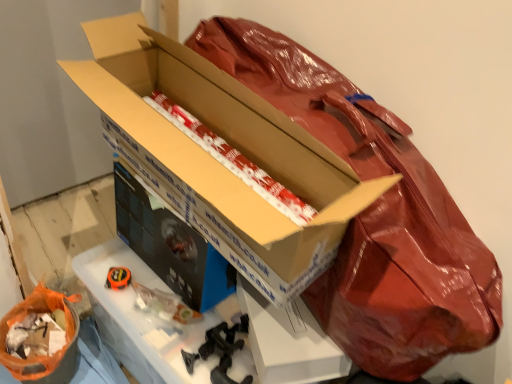
Question: Does black cardboard workbench at center appear on the left side of white/red striped paper at center, the 2th wrapping paper when ordered from left to right?

Choices:
 (A) yes
 (B) no

Answer: (A)

Question: Is black cardboard workbench at center wider than white/red striped paper at center, the 1th wrapping paper positioned from the right?

Choices:
 (A) yes
 (B) no

Answer: (A)

Question: Could you tell me if black cardboard workbench at center is turned towards white/red striped paper at center, the 1th wrapping paper in the top-to-bottom sequence?

Choices:
 (A) yes
 (B) no

Answer: (B)

Question: Is black cardboard workbench at center at the right side of white/red striped paper at center, the 2th wrapping paper when ordered from left to right?

Choices:
 (A) no
 (B) yes

Answer: (A)

Question: Is black cardboard workbench at center far away from white/red striped paper at center, the second wrapping paper ordered from the bottom?

Choices:
 (A) no
 (B) yes

Answer: (A)

Question: Considering the positions of matte cardboard box at center, arranged as the 2th box when viewed from the front, and black cardboard workbench at center in the image, is matte cardboard box at center, arranged as the 2th box when viewed from the front, taller or shorter than black cardboard workbench at center?

Choices:
 (A) tall
 (B) short

Answer: (B)

Question: Is matte cardboard box at center, arranged as the 2th box when viewed from the front, in front of or behind black cardboard workbench at center in the image?

Choices:
 (A) behind
 (B) front

Answer: (A)

Question: Is point (215, 251) positioned closer to the camera than point (293, 339)?

Choices:
 (A) farther
 (B) closer

Answer: (A)

Question: Looking at their shapes, would you say matte cardboard box at center, arranged as the 2th box when viewed from the front, is wider or thinner than black cardboard workbench at center?

Choices:
 (A) wide
 (B) thin

Answer: (B)

Question: From the image's perspective, relative to orange plastic bag at lower left, the first wrapping paper positioned from the left, is cardboard box at center, which is counted as the 2th box, starting from the back, above or below?

Choices:
 (A) below
 (B) above

Answer: (B)

Question: Is point 161,64 positioned closer to the camera than point 58,350?

Choices:
 (A) closer
 (B) farther

Answer: (A)

Question: Considering the positions of cardboard box at center, the 1th box when ordered from front to back, and orange plastic bag at lower left, the 2th wrapping paper in the right-to-left sequence, in the image, is cardboard box at center, the 1th box when ordered from front to back, taller or shorter than orange plastic bag at lower left, the 2th wrapping paper in the right-to-left sequence,?

Choices:
 (A) short
 (B) tall

Answer: (B)

Question: Considering the positions of cardboard box at center, the 1th box when ordered from front to back, and orange plastic bag at lower left, the first wrapping paper in the bottom-to-top sequence, in the image, is cardboard box at center, the 1th box when ordered from front to back, bigger or smaller than orange plastic bag at lower left, the first wrapping paper in the bottom-to-top sequence,?

Choices:
 (A) small
 (B) big

Answer: (B)

Question: Relative to black cardboard workbench at center, is white/red striped paper at center, the 1th wrapping paper in the top-to-bottom sequence, in front or behind?

Choices:
 (A) front
 (B) behind

Answer: (A)

Question: Does point (295, 206) appear closer or farther from the camera than point (314, 357)?

Choices:
 (A) farther
 (B) closer

Answer: (B)